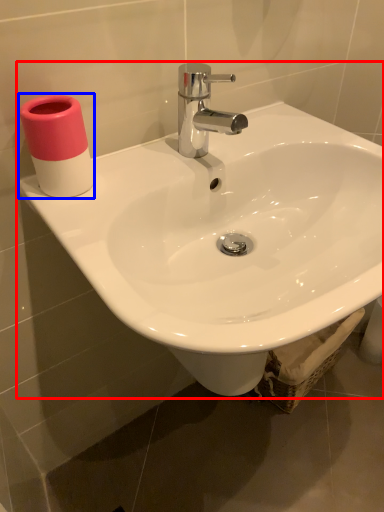
Question: Which point is closer to the camera, sink (highlighted by a red box) or toiletry (highlighted by a blue box)?

Choices:
 (A) sink
 (B) toiletry

Answer: (A)